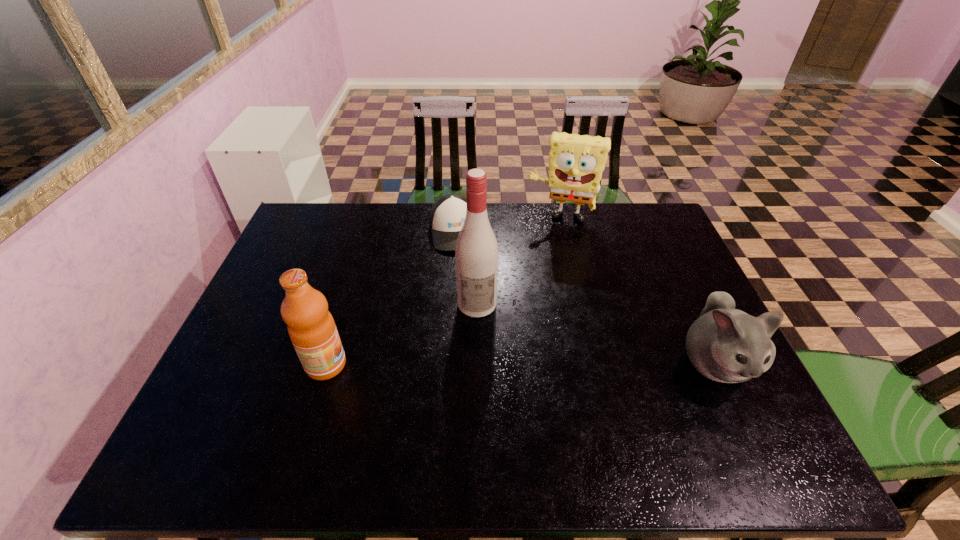
The width and height of the screenshot is (960, 540). I want to click on object at the right edge, so click(724, 344).

Where is `object positioned at the near right corner`? The height and width of the screenshot is (540, 960). object positioned at the near right corner is located at coordinates (724, 344).

Locate an element on the screen. free space at the far edge is located at coordinates (610, 237).

Locate an element on the screen. vacant space at the near edge of the desktop is located at coordinates (631, 408).

The image size is (960, 540). In the image, there is a desktop. What are the coordinates of `free space at the left edge` in the screenshot? It's located at (298, 269).

The height and width of the screenshot is (540, 960). What are the coordinates of `free space at the far left corner of the desktop` in the screenshot? It's located at (317, 216).

Find the location of a particular element. This screenshot has width=960, height=540. vacant space at the near left corner of the desktop is located at coordinates (256, 395).

This screenshot has height=540, width=960. I want to click on free space at the far right corner of the desktop, so click(658, 222).

I want to click on vacant space at the near right corner of the desktop, so click(x=705, y=396).

The image size is (960, 540). Identify the location of vacant point located between the leftmost object and the sponge. pyautogui.click(x=444, y=292).